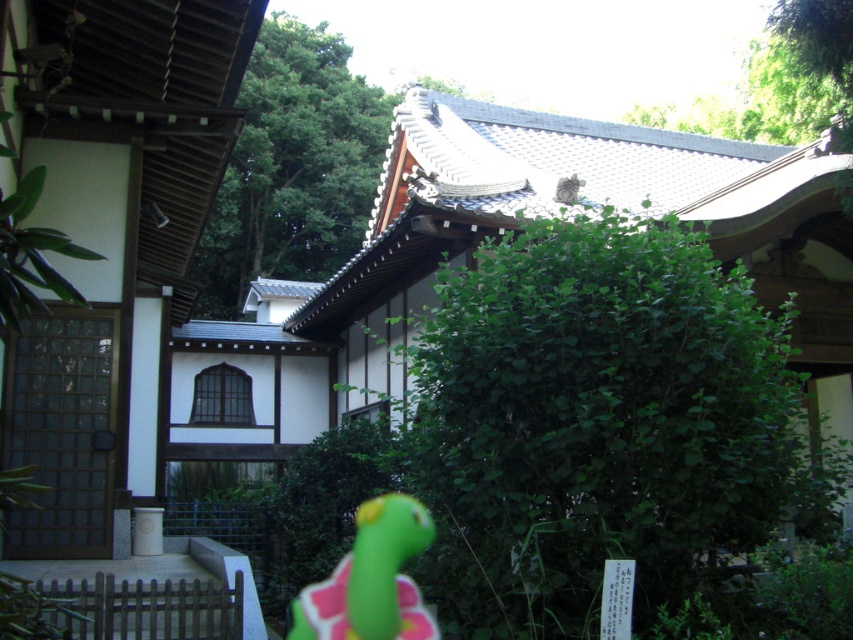
Between point (315, 102) and point (566, 202), which one is positioned behind?

The point (315, 102) is more distant.

Is green leafy tree at upper center positioned before gray furry cat at upper center?

Yes, it is.

The image size is (853, 640). I want to click on green leafy tree at upper center, so click(x=292, y=168).

Who is taller, green rubber toy at lower center or gray furry cat at upper center?

green rubber toy at lower center is taller.

The height and width of the screenshot is (640, 853). What do you see at coordinates (370, 579) in the screenshot? I see `green rubber toy at lower center` at bounding box center [370, 579].

Identify the location of green rubber toy at lower center. pos(370,579).

Can you confirm if green leafy bush at center is thinner than green leafy tree at upper center?

Yes, green leafy bush at center is thinner than green leafy tree at upper center.

Which is in front, point (746, 330) or point (335, 113)?

Point (746, 330)

Where is `green leafy bush at center`? Image resolution: width=853 pixels, height=640 pixels. green leafy bush at center is located at coordinates (602, 426).